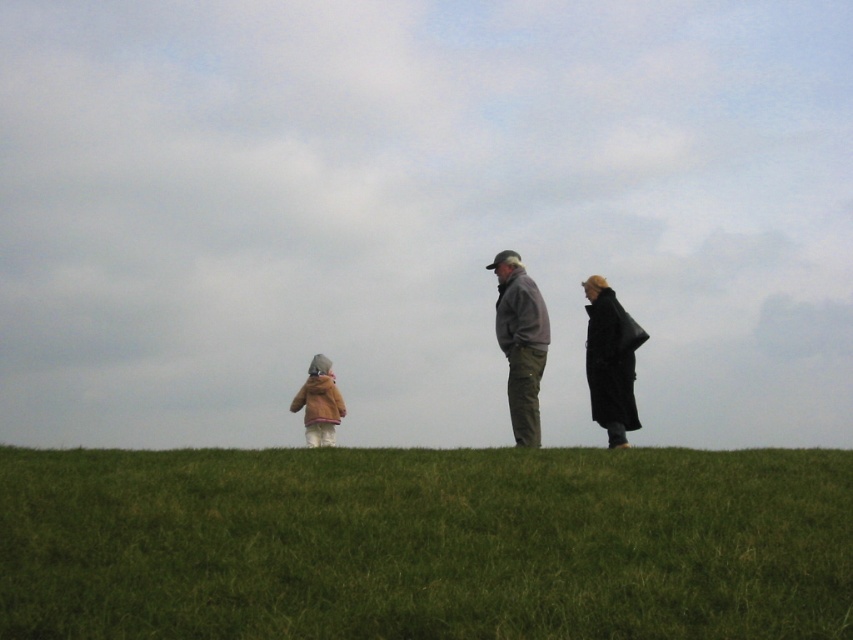
You are standing on the grassy hill and want to find the light brown fuzzy coat at lower left. Which direction should you look relative to the green grassy hill at lower center?

The light brown fuzzy coat at lower left is to the left of the green grassy hill at lower center, so you should look to the left direction relative to the green grassy hill at lower center.

You are standing at the point marked as point (x=425, y=544) in the image. Looking around, you see a grassy hill with three people. Which direction should you walk to reach the adult female standing to the right?

A: The point (x=425, y=544) is located on the green grassy hill at lower center. Since the adult female is positioned to the right in the image, you should walk towards the right direction from the point to reach her.

You are planning to set up a picnic blanket on the green grassy hill at lower center. Considering the size of the light brown fuzzy coat at lower left, will there be enough space for both the picnic blanket and the coat?

The green grassy hill at lower center has a smaller size compared to the light brown fuzzy coat at lower left. Since the hill is smaller, there might not be enough space to accommodate both the picnic blanket and the coat comfortably.